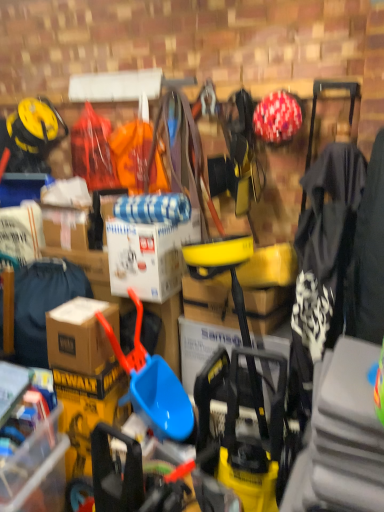
Question: Is brown cardboard box at left, the 2th clothing in the right-to-left sequence, at the left side of brown cardboard box at lower left?

Choices:
 (A) no
 (B) yes

Answer: (A)

Question: Is brown cardboard box at lower left completely or partially inside brown cardboard box at left, the 1th clothing from the left?

Choices:
 (A) no
 (B) yes

Answer: (A)

Question: Is brown cardboard box at lower left at the back of brown cardboard box at left, the 1th clothing from the left?

Choices:
 (A) yes
 (B) no

Answer: (B)

Question: Is brown cardboard box at left, which is counted as the 2th clothing, starting from the front, outside of brown cardboard box at lower left?

Choices:
 (A) yes
 (B) no

Answer: (A)

Question: Would you consider brown cardboard box at left, which is the first clothing from back to front, to be distant from brown cardboard box at lower left?

Choices:
 (A) no
 (B) yes

Answer: (A)

Question: Does point (173, 419) appear closer or farther from the camera than point (34, 297)?

Choices:
 (A) farther
 (B) closer

Answer: (B)

Question: Considering the relative positions of blue plastic shovel at center and brown cardboard box at left, which is counted as the 2th clothing, starting from the front, in the image provided, is blue plastic shovel at center to the left or to the right of brown cardboard box at left, which is counted as the 2th clothing, starting from the front,?

Choices:
 (A) left
 (B) right

Answer: (B)

Question: Which is correct: blue plastic shovel at center is inside brown cardboard box at left, the 2th clothing in the right-to-left sequence, or outside of it?

Choices:
 (A) inside
 (B) outside

Answer: (B)

Question: In terms of size, does blue plastic shovel at center appear bigger or smaller than brown cardboard box at left, which is the first clothing from back to front?

Choices:
 (A) small
 (B) big

Answer: (B)

Question: Is point (82, 330) closer or farther from the camera than point (379, 223)?

Choices:
 (A) farther
 (B) closer

Answer: (A)

Question: Considering their positions, is brown cardboard box at lower left located in front of or behind black fabric jacket at right, marked as the second clothing in a back-to-front arrangement?

Choices:
 (A) front
 (B) behind

Answer: (B)

Question: Is brown cardboard box at lower left to the left or to the right of black fabric jacket at right, marked as the second clothing in a back-to-front arrangement, in the image?

Choices:
 (A) right
 (B) left

Answer: (B)

Question: From the image's perspective, is brown cardboard box at lower left above or below black fabric jacket at right, marked as the second clothing in a back-to-front arrangement?

Choices:
 (A) below
 (B) above

Answer: (A)

Question: From a real-world perspective, is black fabric jacket at right, marked as the second clothing in a back-to-front arrangement, positioned above or below brown cardboard box at lower left?

Choices:
 (A) below
 (B) above

Answer: (B)

Question: Is black fabric jacket at right, the first clothing from the right, taller or shorter than brown cardboard box at lower left?

Choices:
 (A) tall
 (B) short

Answer: (A)